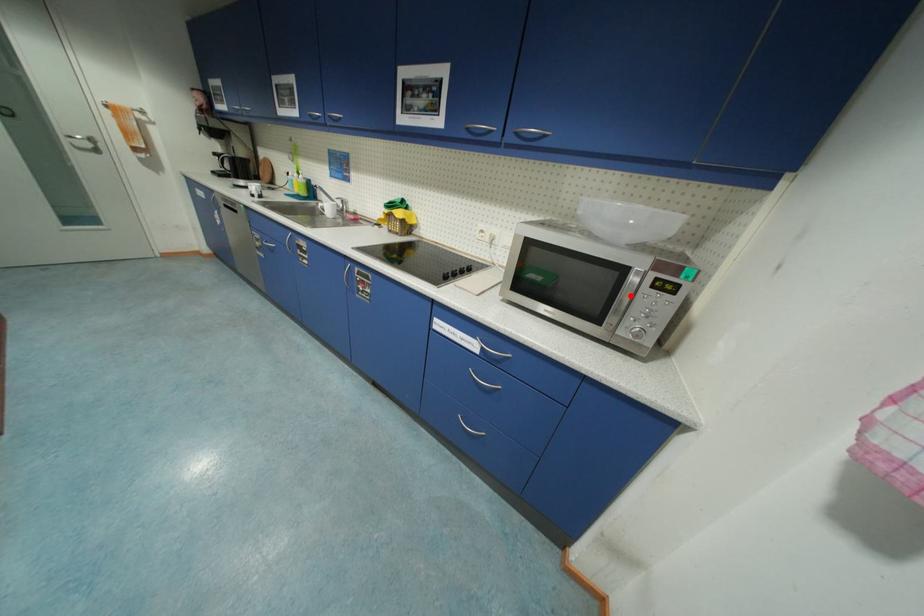
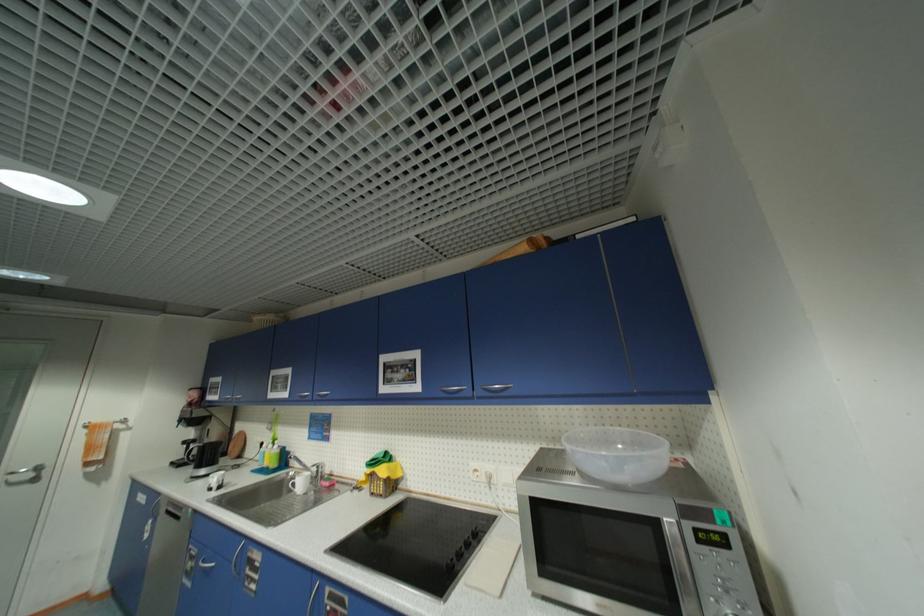
The point at the highlighted location is marked in the first image. Where is the corresponding point in the second image?

(682, 556)